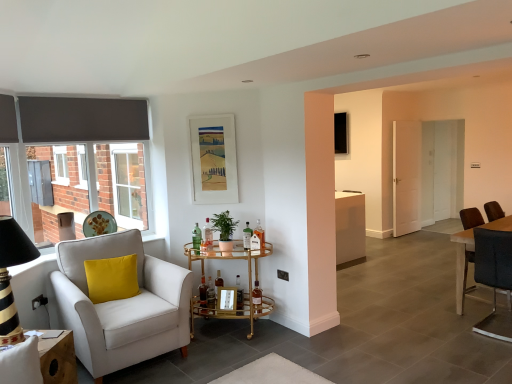
How much space does black plastic power outlet at lower left, the 1th power outlet when ordered from right to left, occupy horizontally?

The width of black plastic power outlet at lower left, the 1th power outlet when ordered from right to left, is 0.55 inches.

What are the coordinates of `wooden side table at lower left` in the screenshot? It's located at (58, 359).

This screenshot has width=512, height=384. Find the location of `black leather chair at right, positioned as the second chair in left-to-right order`. black leather chair at right, positioned as the second chair in left-to-right order is located at coordinates (494, 278).

In order to click on black plastic power outlet at lower left, the 1th power outlet when ordered from right to left in this screenshot , I will do point(282,275).

Are green matte plant at center and matte paper picture frame at upper center, the 1th picture frame viewed from the front, located far from each other?

green matte plant at center is actually quite close to matte paper picture frame at upper center, the 1th picture frame viewed from the front.

Which is correct: green matte plant at center is inside matte paper picture frame at upper center, the 1th picture frame viewed from the front, or outside of it?

green matte plant at center exists outside the volume of matte paper picture frame at upper center, the 1th picture frame viewed from the front.

Is green matte plant at center further to camera compared to matte paper picture frame at upper center, the second picture frame when ordered from right to left?

No, it is in front of matte paper picture frame at upper center, the second picture frame when ordered from right to left.

Is green matte plant at center facing towards matte paper picture frame at upper center, the second picture frame when ordered from right to left?

No, green matte plant at center is not oriented towards matte paper picture frame at upper center, the second picture frame when ordered from right to left.

Is green glass bottle at center, the 9th bottle when ordered from right to left, aimed at striped wood lampshade at left?

No.

From a real-world perspective, who is located higher, green glass bottle at center, the 9th bottle when ordered from right to left, or striped wood lampshade at left?

striped wood lampshade at left is physically above.

Looking at their sizes, would you say green glass bottle at center, the 9th bottle when ordered from right to left, is wider or thinner than striped wood lampshade at left?

Clearly, green glass bottle at center, the 9th bottle when ordered from right to left, has less width compared to striped wood lampshade at left.

Which is further, (194, 249) or (14, 231)?

Point (194, 249)

Choose the correct answer: Is green glass bottle at center, the 9th bottle when ordered from right to left, inside translucent glass bottle at center, which is the fourth bottle from right to left, or outside it?

green glass bottle at center, the 9th bottle when ordered from right to left, is spatially situated outside translucent glass bottle at center, which is the fourth bottle from right to left.

From the image's perspective, is green glass bottle at center, the first bottle when ordered from left to right, located above or below translucent glass bottle at center, which is the fourth bottle from right to left?

From the image's perspective, green glass bottle at center, the first bottle when ordered from left to right, appears above translucent glass bottle at center, which is the fourth bottle from right to left.

Is green glass bottle at center, the first bottle when ordered from left to right, oriented towards translucent glass bottle at center, the 6th bottle from the left?

No, green glass bottle at center, the first bottle when ordered from left to right, is not facing towards translucent glass bottle at center, the 6th bottle from the left.

Is green glass bottle at center, the first bottle when ordered from left to right, to the left of translucent glass bottle at center, which is the fourth bottle from right to left, from the viewer's perspective?

Indeed, green glass bottle at center, the first bottle when ordered from left to right, is positioned on the left side of translucent glass bottle at center, which is the fourth bottle from right to left.

Can white wooden door at right be found inside black plastic power outlet at lower left, arranged as the second power outlet when viewed from the back?

No, black plastic power outlet at lower left, arranged as the second power outlet when viewed from the back, does not contain white wooden door at right.

Could you tell me if black plastic power outlet at lower left, arranged as the second power outlet when viewed from the back, is turned towards white wooden door at right?

No, black plastic power outlet at lower left, arranged as the second power outlet when viewed from the back, does not turn towards white wooden door at right.

From a real-world perspective, between black plastic power outlet at lower left, acting as the 1th power outlet starting from the left, and white wooden door at right, who is vertically lower?

In real-world perspective, black plastic power outlet at lower left, acting as the 1th power outlet starting from the left, is lower.

Which of these two, gold mirrored bar cart at center or matte paper picture frame at upper center, the 1th picture frame viewed from the front, stands shorter?

With less height is gold mirrored bar cart at center.

From a real-world perspective, who is located lower, gold mirrored bar cart at center or matte paper picture frame at upper center, the second picture frame when ordered from right to left?

gold mirrored bar cart at center is physically lower.

Does gold mirrored bar cart at center come in front of matte paper picture frame at upper center, the first picture frame from the bottom?

Yes, it is.

Is point (251, 324) positioned before point (207, 200)?

That is True.

In the scene shown: From a real-world perspective, who is located higher, black plastic power outlet at lower left, the first power outlet in the back-to-front sequence, or green glass bottle at center, arranged as the third bottle when viewed from the left?

green glass bottle at center, arranged as the third bottle when viewed from the left, is physically above.

Considering the positions of objects black plastic power outlet at lower left, which appears as the 2th power outlet when viewed from the front, and green glass bottle at center, arranged as the third bottle when viewed from the left, in the image provided, who is more to the right, black plastic power outlet at lower left, which appears as the 2th power outlet when viewed from the front, or green glass bottle at center, arranged as the third bottle when viewed from the left,?

black plastic power outlet at lower left, which appears as the 2th power outlet when viewed from the front, is more to the right.

Considering the relative sizes of black plastic power outlet at lower left, the 2th power outlet positioned from the left, and green glass bottle at center, arranged as the third bottle when viewed from the left, in the image provided, is black plastic power outlet at lower left, the 2th power outlet positioned from the left, thinner than green glass bottle at center, arranged as the third bottle when viewed from the left,?

Yes.

Is black plastic power outlet at lower left, the first power outlet in the back-to-front sequence, outside of green glass bottle at center, arranged as the third bottle when viewed from the left?

Yes.

Would you say gold mirrored bar cart at center contains white wooden door at right?

That's incorrect, white wooden door at right is not inside gold mirrored bar cart at center.

From the picture: Based on their sizes in the image, would you say gold mirrored bar cart at center is bigger or smaller than white wooden door at right?

gold mirrored bar cart at center is bigger than white wooden door at right.

Considering the sizes of gold mirrored bar cart at center and white wooden door at right in the image, is gold mirrored bar cart at center wider or thinner than white wooden door at right?

Considering their sizes, gold mirrored bar cart at center looks broader than white wooden door at right.

From the image's perspective, which object appears higher, gold mirrored bar cart at center or white wooden door at right?

white wooden door at right is shown above in the image.

The height and width of the screenshot is (384, 512). Find the location of `houseplant in front of the matte paper picture frame at upper center, the 2th picture frame in the back-to-front sequence`. houseplant in front of the matte paper picture frame at upper center, the 2th picture frame in the back-to-front sequence is located at coordinates (224, 229).

Where is `lamp that is above the green glass bottle at center, the first bottle when ordered from left to right (from a real-world perspective)`? This screenshot has width=512, height=384. lamp that is above the green glass bottle at center, the first bottle when ordered from left to right (from a real-world perspective) is located at coordinates (10, 277).

Which object lies nearer to the anchor point striped wood lampshade at left, translucent glass bottle at center, the 8th bottle when ordered from right to left, or green glass bottle at center, the first bottle when ordered from left to right?

The object closer to striped wood lampshade at left is green glass bottle at center, the first bottle when ordered from left to right.

Which object lies nearer to the anchor point translucent glass bottle at center, placed as the 8th bottle when sorted from left to right, matte paper picture frame at upper center, the 2th picture frame in the top-to-bottom sequence, or white wooden table at right?

Based on the image, matte paper picture frame at upper center, the 2th picture frame in the top-to-bottom sequence, appears to be nearer to translucent glass bottle at center, placed as the 8th bottle when sorted from left to right.

From the image, which object appears to be farther from white matte door at center-right, black glossy picture frame at upper center, which is the first picture frame from back to front, or translucent glass bottle at center, the third bottle viewed from the right?

The object further to white matte door at center-right is translucent glass bottle at center, the third bottle viewed from the right.

Considering their positions, is translucent glass bottle at center, which appears as the 2th bottle when viewed from the right, positioned further to green glass bottle at center, the first bottle when ordered from left to right, than white matte door at center-right?

white matte door at center-right is positioned further to the anchor green glass bottle at center, the first bottle when ordered from left to right.

Looking at the image, which one is located further to white wooden door at right, green glass bottle at center, the 7th bottle from the right, or translucent glass bottle at center, the 6th bottle from the right?

Among the two, translucent glass bottle at center, the 6th bottle from the right, is located further to white wooden door at right.

Looking at this image, from the image, which object appears to be nearer to white matte door at center-right, translucent glass bottle at center, the 6th bottle from the right, or black glossy picture frame at upper center, the first picture frame viewed from the top?

The object closer to white matte door at center-right is black glossy picture frame at upper center, the first picture frame viewed from the top.

Based on their spatial positions, is striped wood lampshade at left or gold mirrored bar cart at center closer to white wooden door at right?

gold mirrored bar cart at center is positioned closer to the anchor white wooden door at right.

Looking at the image, which one is located further to yellow velvet pillow at left, gold mirrored bar cart at center or green glass bottle at center, the 9th bottle when ordered from right to left?

The object further to yellow velvet pillow at left is gold mirrored bar cart at center.

Where is `pillow between black leather chair at right, which is the first chair in right-to-left order, and white matte door at center-right in the front-back direction`? The image size is (512, 384). pillow between black leather chair at right, which is the first chair in right-to-left order, and white matte door at center-right in the front-back direction is located at coordinates (112, 278).

Image resolution: width=512 pixels, height=384 pixels. What are the coordinates of `table positioned between wooden side table at lower left and green glass bottle at center, the 9th bottle when ordered from right to left, from near to far` in the screenshot? It's located at (248, 284).

This screenshot has width=512, height=384. In order to click on table between striped wood lampshade at left and black leather chair at right, positioned as the second chair in left-to-right order, from left to right in this screenshot , I will do `click(248, 284)`.

Identify the location of desk between green glass bottle at center, the 9th bottle when ordered from right to left, and black glossy picture frame at upper center, which ranks as the 2th picture frame in front-to-back order, along the z-axis. The width and height of the screenshot is (512, 384). (462, 265).